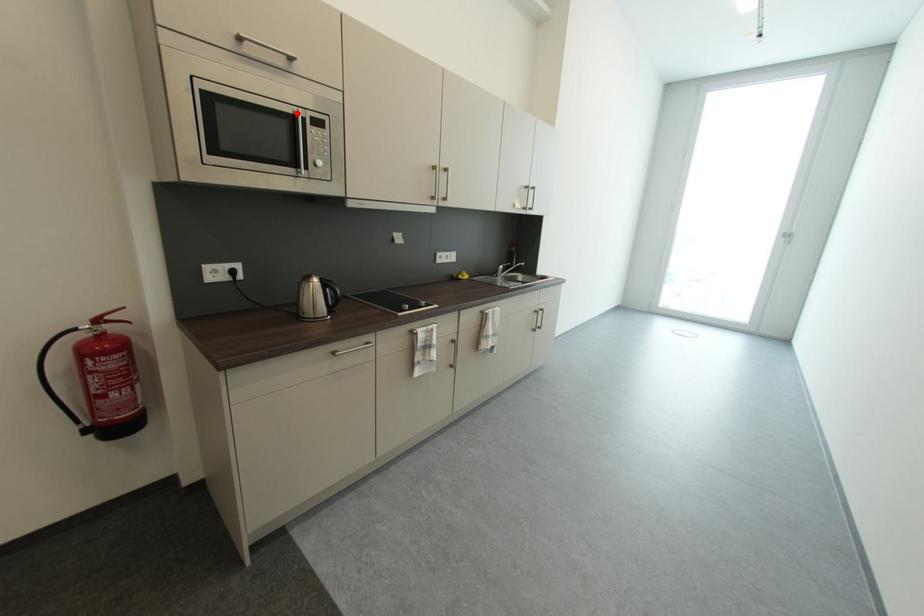
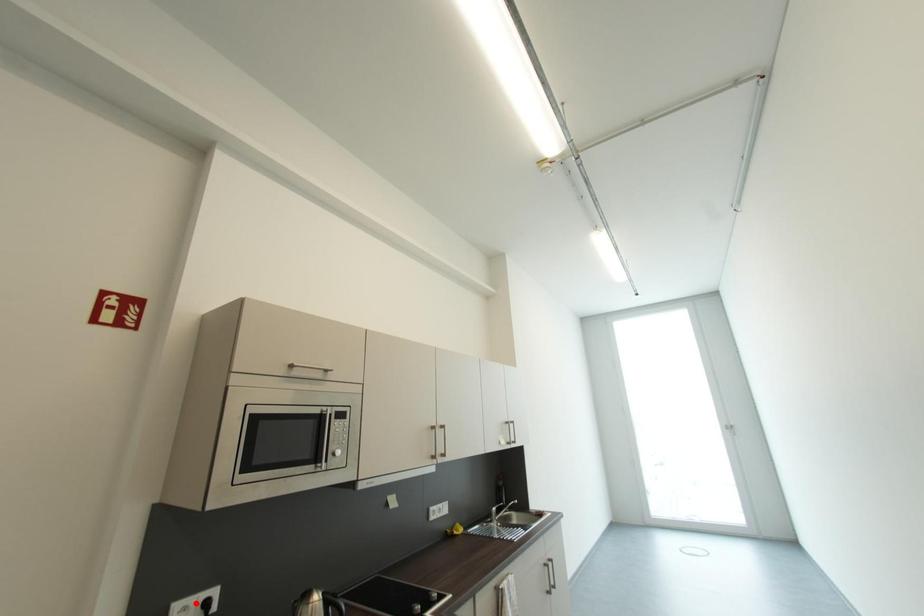
I am providing you with two images of the same scene from different viewpoints. A red point is marked on the first image and another point is marked on the second image. Is the marked point in image1 the same physical position as the marked point in image2?

No